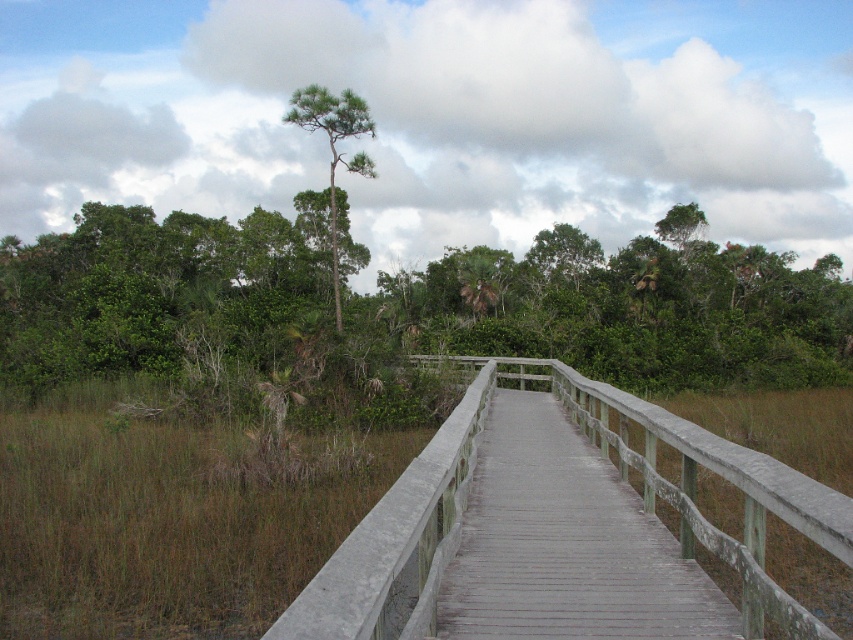
You are a hiker who wants to take a photo of the green textured tree at upper center from the gray wooden boardwalk at center. Considering their heights, will the boardwalk block your view of the tree?

The gray wooden boardwalk at center has a lesser height compared to green textured tree at upper center, so the boardwalk will not block your view of the tree.

You are a maintenance worker needing to inspect both the gray wooden bridge at center and the gray wooden boardwalk at center. Which structure will require you to climb higher to reach its top surface?

The gray wooden bridge at center is taller than the gray wooden boardwalk at center, so you will need to climb higher to reach the top surface of the gray wooden bridge at center.